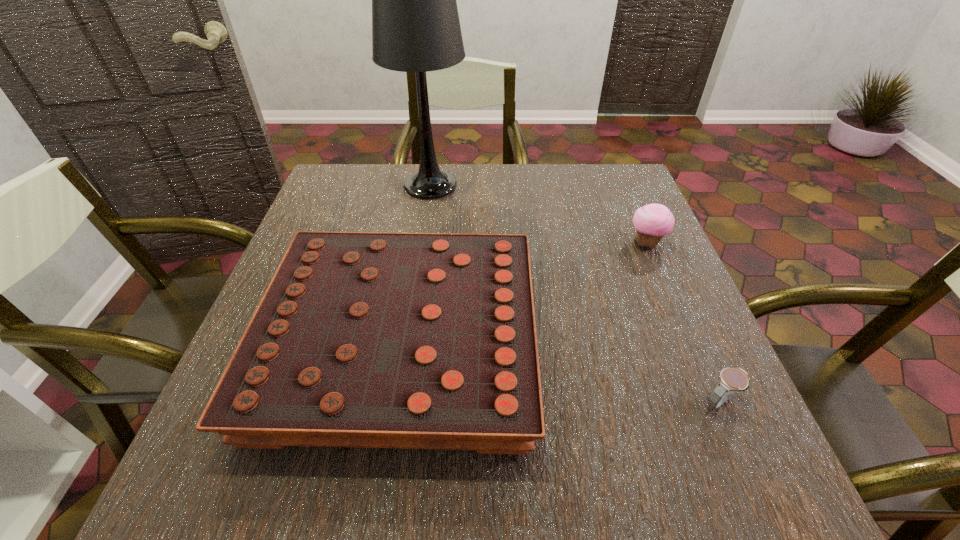
Image resolution: width=960 pixels, height=540 pixels. In order to click on blank region between the table lamp and the second farthest object in this screenshot , I will do `click(539, 214)`.

Identify the location of free space between the shortest object and the gameboard. This screenshot has width=960, height=540. (560, 372).

Identify the location of empty location between the third nearest object and the watch. (683, 322).

Identify the location of free point between the cupcake and the farthest object. (539, 214).

The height and width of the screenshot is (540, 960). What are the coordinates of `free space between the shortest object and the cupcake` in the screenshot? It's located at (683, 322).

Identify the location of vacant point located between the third nearest object and the tallest object. This screenshot has width=960, height=540. (539, 214).

Locate an element on the screen. The image size is (960, 540). free space between the tallest object and the cupcake is located at coordinates (539, 214).

The image size is (960, 540). In order to click on vacant area that lies between the table lamp and the third nearest object in this screenshot , I will do `click(539, 214)`.

Identify the location of vacant area that lies between the watch and the cupcake. The image size is (960, 540). (683, 322).

Identify which object is the third nearest to the farthest object. Please provide its 2D coordinates. Your answer should be formatted as a tuple, i.e. [(x, y)], where the tuple contains the x and y coordinates of a point satisfying the conditions above.

[(731, 379)]